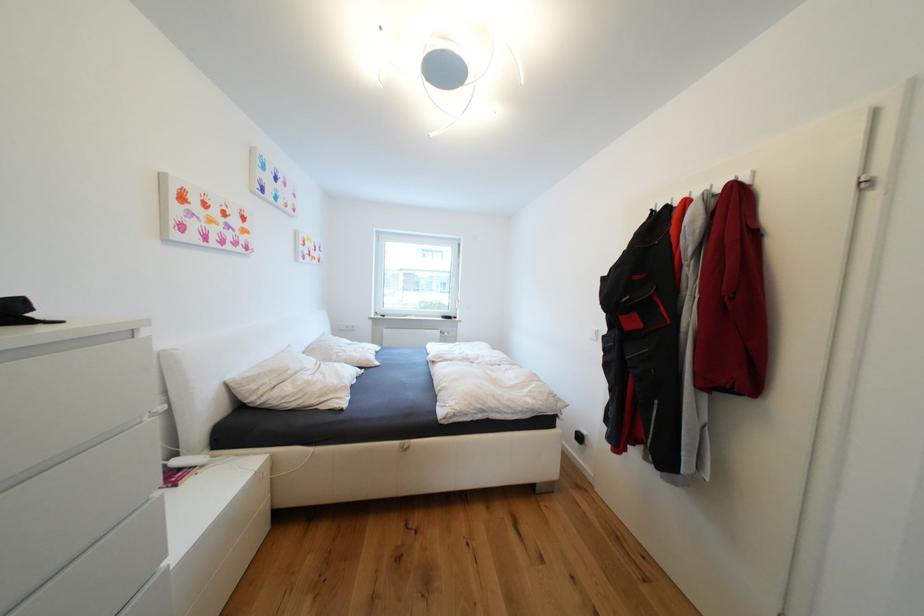
Locate an element on the screen. white light switch is located at coordinates (346, 326).